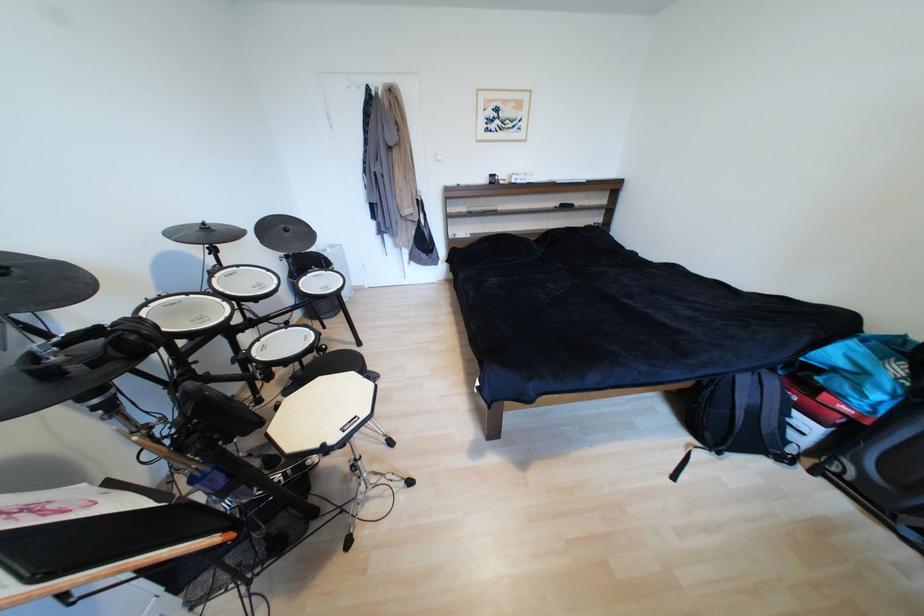
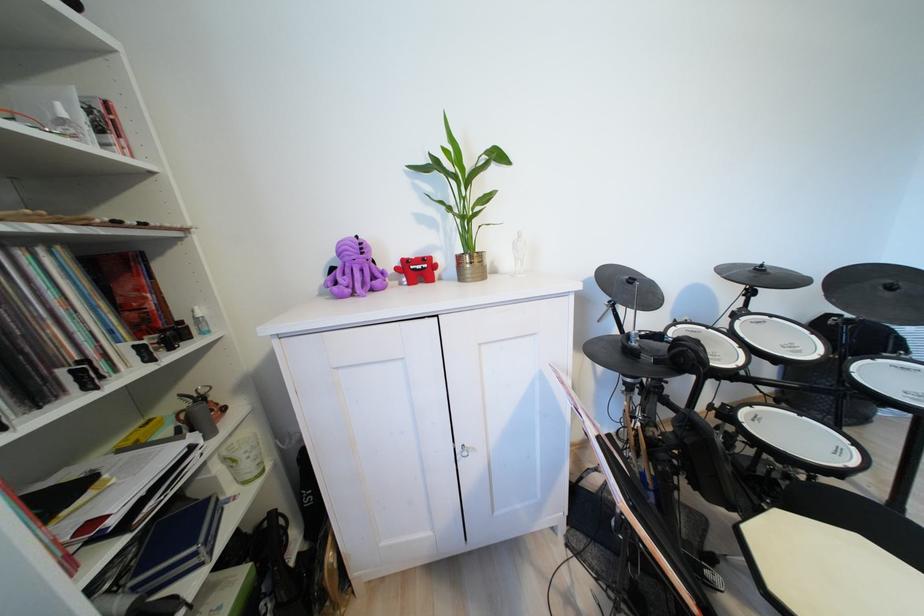
Question: I am providing you with two images of the same scene from different viewpoints. Please identify which objects are invisible in image2.

Choices:
 (A) red monster toy
 (B) white spray bottle
 (C) black headphones
 (D) none of these

Answer: (D)